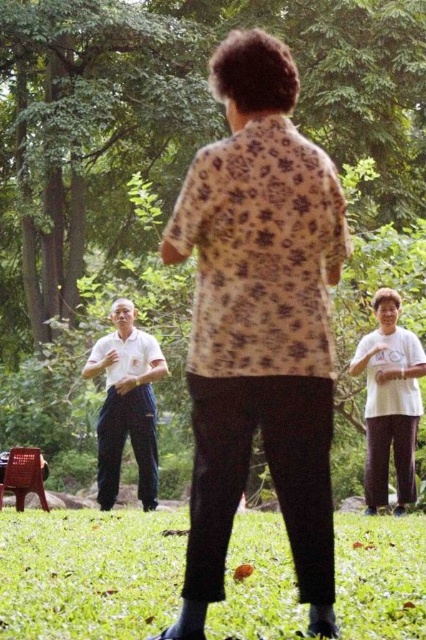
Question: Estimate the real-world distances between objects in this image. Which object is farther from the green grass at lower center?

Choices:
 (A) green leafy tree at upper center
 (B) white matte t-shirt at center

Answer: (A)

Question: Does floral-patterned shirt at center have a greater width compared to green grass at lower center?

Choices:
 (A) no
 (B) yes

Answer: (A)

Question: Can you confirm if floral-patterned shirt at center is bigger than white matte t-shirt at center?

Choices:
 (A) no
 (B) yes

Answer: (A)

Question: Which of the following is the farthest from the observer?

Choices:
 (A) white matte t-shirt at center
 (B) white smooth shirt at left

Answer: (B)

Question: Does green grass at lower center appear on the right side of white smooth shirt at left?

Choices:
 (A) no
 (B) yes

Answer: (B)

Question: Which object appears closest to the camera in this image?

Choices:
 (A) white smooth shirt at left
 (B) green leafy tree at upper center

Answer: (A)